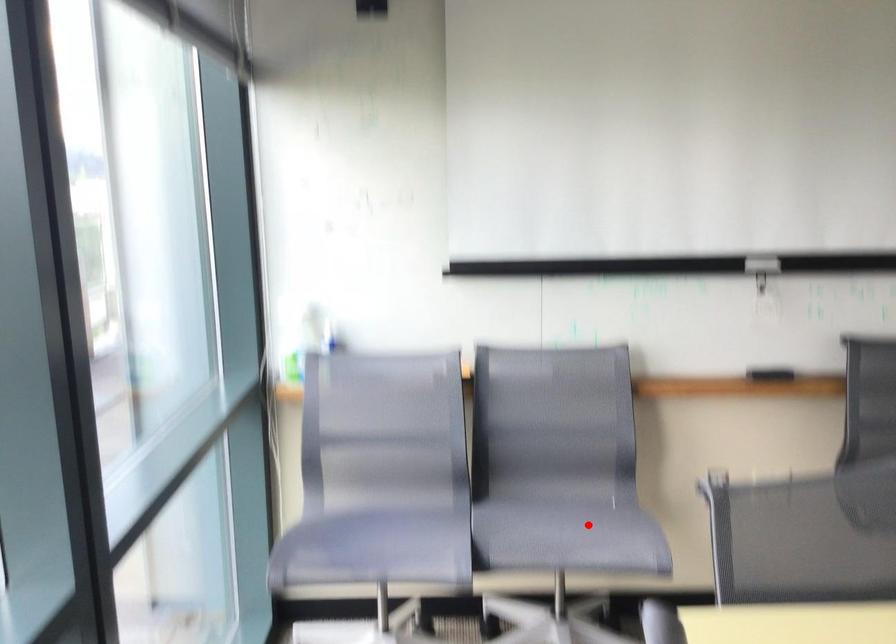
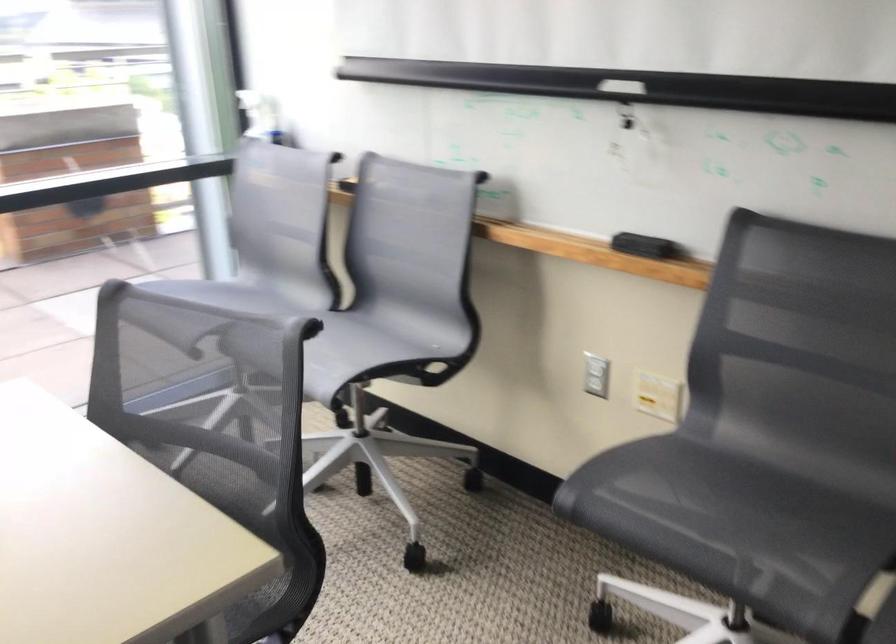
In the second image, find the point that corresponds to the highlighted location in the first image.

(348, 351)